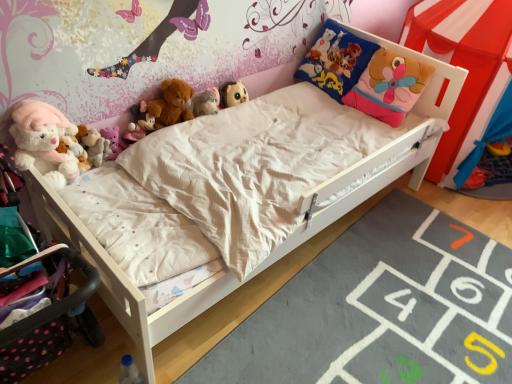
Question: Is matte pink plush at upper left, which ranks as the fourth toy in top-to-bottom order, to the right of blue plastic bottle at lower left, the 8th toy from the top, from the viewer's perspective?

Choices:
 (A) no
 (B) yes

Answer: (A)

Question: Does matte pink plush at upper left, which is counted as the fifth toy, starting from the bottom, have a larger size compared to blue plastic bottle at lower left, the 8th toy from the top?

Choices:
 (A) no
 (B) yes

Answer: (B)

Question: From a real-world perspective, is matte pink plush at upper left, which ranks as the fourth toy in top-to-bottom order, located higher than blue plastic bottle at lower left, the first toy ordered from the bottom?

Choices:
 (A) no
 (B) yes

Answer: (B)

Question: Does matte pink plush at upper left, which ranks as the fourth toy in top-to-bottom order, come behind blue plastic bottle at lower left, the first toy ordered from the bottom?

Choices:
 (A) no
 (B) yes

Answer: (B)

Question: Does matte pink plush at upper left, which is counted as the fifth toy, starting from the bottom, have a lesser width compared to blue plastic bottle at lower left, the 8th toy from the top?

Choices:
 (A) yes
 (B) no

Answer: (B)

Question: From the image's perspective, is blue plastic bottle at lower left, the first toy ordered from the bottom, positioned above or below pink plush toy at upper left, which ranks as the 5th toy in top-to-bottom order?

Choices:
 (A) below
 (B) above

Answer: (A)

Question: In terms of height, does blue plastic bottle at lower left, the first toy ordered from the bottom, look taller or shorter compared to pink plush toy at upper left, which ranks as the 5th toy in top-to-bottom order?

Choices:
 (A) short
 (B) tall

Answer: (B)

Question: Looking at the image, does blue plastic bottle at lower left, the first toy ordered from the bottom, seem bigger or smaller compared to pink plush toy at upper left, which ranks as the 5th toy in top-to-bottom order?

Choices:
 (A) big
 (B) small

Answer: (A)

Question: In the image, is blue plastic bottle at lower left, the first toy ordered from the bottom, on the left side or the right side of pink plush toy at upper left, which appears as the fourth toy when ordered from the bottom?

Choices:
 (A) right
 (B) left

Answer: (A)

Question: Visually, is fluffy plush toys at left, which ranks as the 6th toy in top-to-bottom order, positioned to the left or to the right of blue plastic bottle at lower left, the 8th toy from the top?

Choices:
 (A) right
 (B) left

Answer: (B)

Question: In terms of height, does fluffy plush toys at left, the third toy positioned from the bottom, look taller or shorter compared to blue plastic bottle at lower left, the 8th toy from the top?

Choices:
 (A) short
 (B) tall

Answer: (A)

Question: From the image's perspective, is fluffy plush toys at left, the third toy positioned from the bottom, positioned above or below blue plastic bottle at lower left, the 8th toy from the top?

Choices:
 (A) below
 (B) above

Answer: (B)

Question: Considering their positions, is fluffy plush toys at left, which ranks as the 6th toy in top-to-bottom order, located in front of or behind blue plastic bottle at lower left, the 8th toy from the top?

Choices:
 (A) behind
 (B) front

Answer: (A)

Question: From a real-world perspective, is blue plastic bottle at lower left, the 8th toy from the top, physically located above or below fluffy plush toy at upper center, which is the 7th toy from bottom to top?

Choices:
 (A) below
 (B) above

Answer: (A)

Question: Is blue plastic bottle at lower left, the 8th toy from the top, in front of or behind fluffy plush toy at upper center, which is the 7th toy from bottom to top, in the image?

Choices:
 (A) behind
 (B) front

Answer: (B)